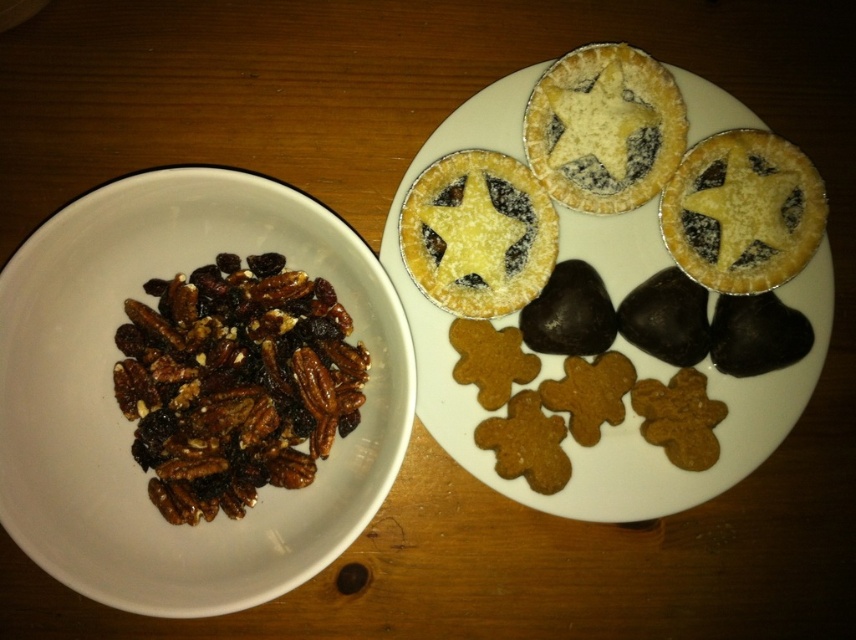
You are planning to place a rectangular box that is 10 cm wide on the table. The box must be placed between the brown crunchy nuts at left and the matte golden pie at upper right. Considering their widths, will the space between them be sufficient to fit the box?

The brown crunchy nuts at left is wider than the matte golden pie at upper right. Therefore, the space between them may not be enough to fit a 10 cm wide box since the nuts are wider, potentially reducing the available space between them.

You are a chef preparing a dessert platter and need to arrange the brown crunchy nuts at left and the golden crumbly pastry at upper center on the table. Based on the current arrangement, where should you place the nuts and pastry to maintain the existing spatial relationship?

The brown crunchy nuts at left should be placed below the golden crumbly pastry at upper center to maintain the existing spatial relationship.